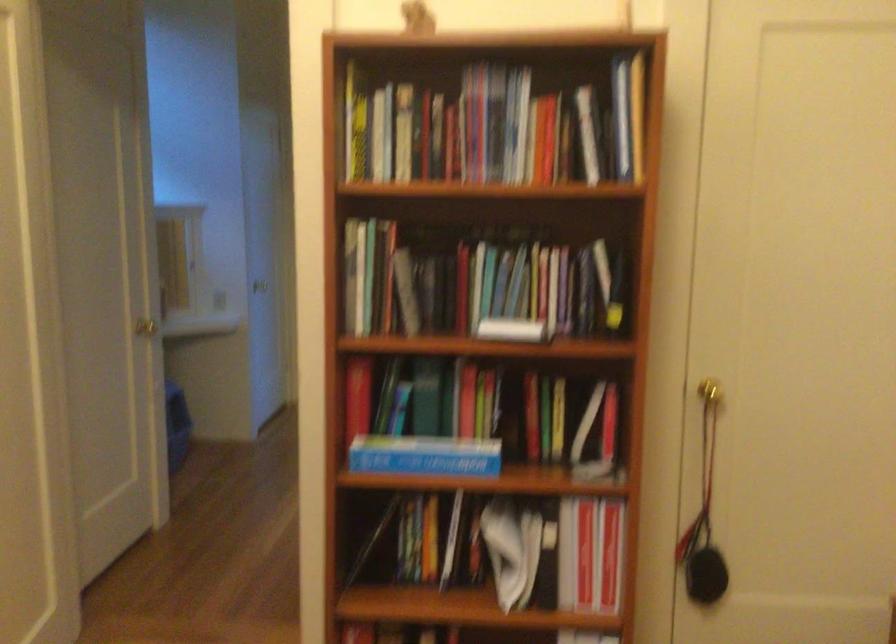
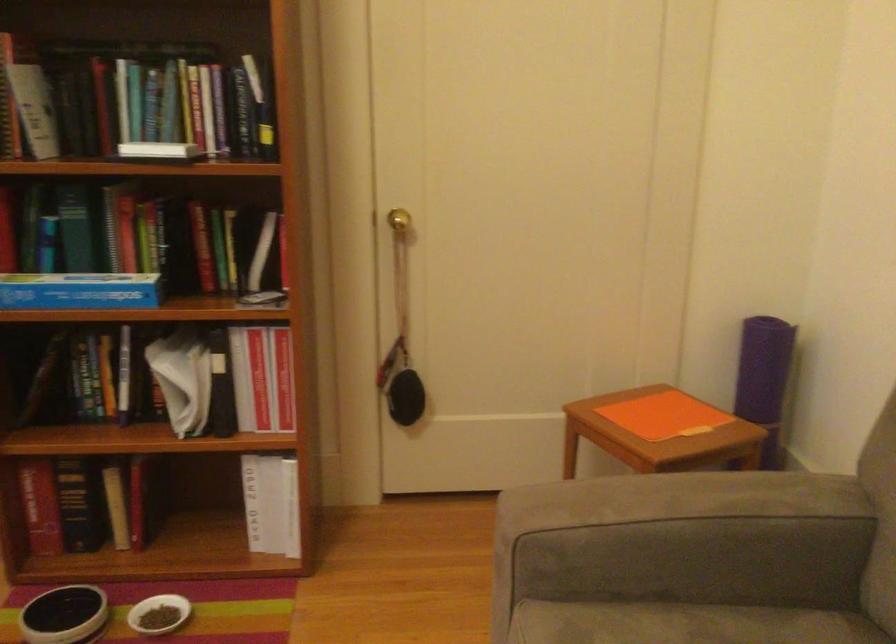
Question: The images are taken continuously from a first-person perspective. In which direction is your viewpoint rotating?

Choices:
 (A) Left
 (B) Right
 (C) Up
 (D) Down

Answer: (D)